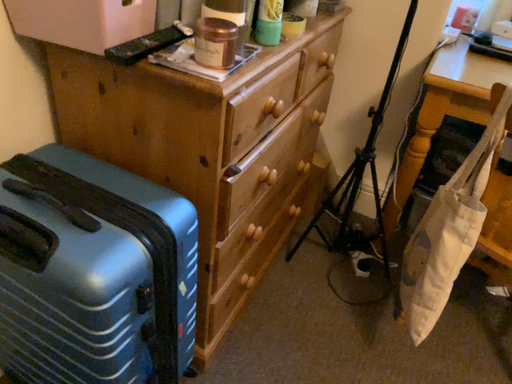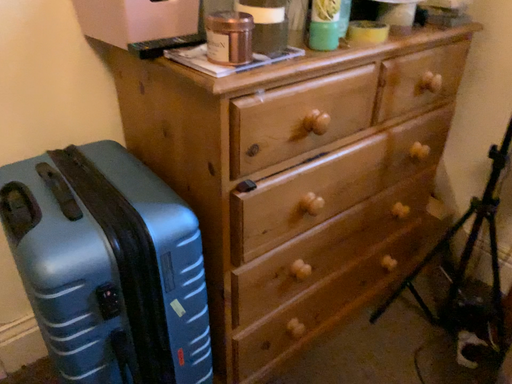
Question: How did the camera likely rotate when shooting the video?

Choices:
 (A) rotated right
 (B) rotated left

Answer: (B)